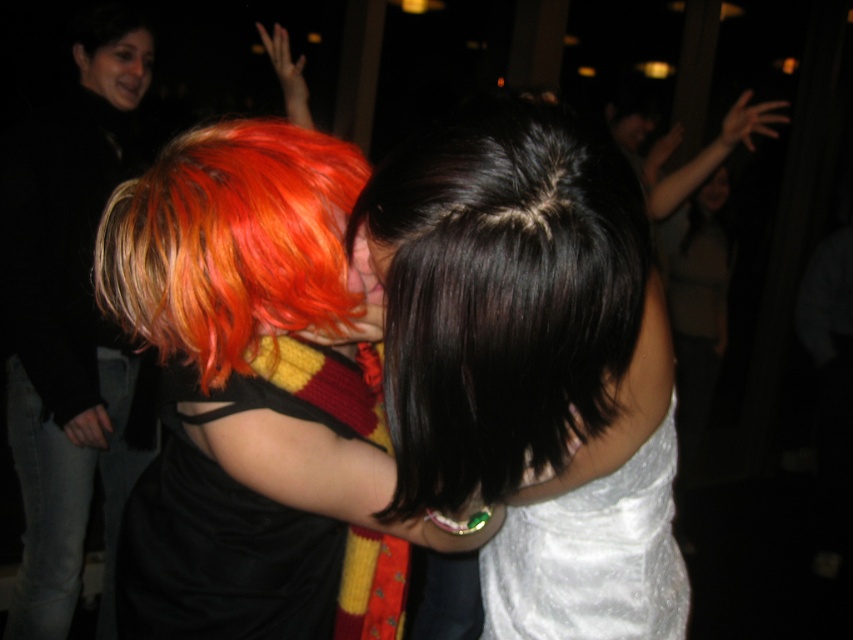
Is black satin dress at center taller than white satin dress at center?

Yes, black satin dress at center is taller than white satin dress at center.

Does black satin dress at center appear under white satin dress at center?

No, black satin dress at center is not below white satin dress at center.

Does point (303, 548) come in front of point (508, 566)?

Yes, point (303, 548) is in front of point (508, 566).

You are a GUI agent. You are given a task and a screenshot of the screen. Output one action in this format:
    pyautogui.click(x=<x>, y=<y>)
    Task: Click on the black satin dress at center
    The width and height of the screenshot is (853, 640).
    Given the screenshot: What is the action you would take?
    pyautogui.click(x=254, y=522)

Is the position of black satin dress at center less distant than that of shiny orange wig at center?

No, it is not.

In the scene shown: Between black satin dress at center and shiny orange wig at center, which one appears on the left side from the viewer's perspective?

Positioned to the left is shiny orange wig at center.

Does point (223, 636) come behind point (194, 154)?

That is True.

The image size is (853, 640). I want to click on black satin dress at center, so click(x=254, y=522).

Between point (491, 595) and point (596, 563), which one is positioned behind?

Positioned behind is point (491, 595).

Can you confirm if shiny black hair at center is thinner than white satin dress at center?

In fact, shiny black hair at center might be wider than white satin dress at center.

Is point (483, 404) behind point (535, 552)?

No, it is not.

At what (x,y) coordinates should I click in order to perform the action: click on shiny black hair at center. Please return your answer as a coordinate pair (x, y). Looking at the image, I should click on (532, 365).